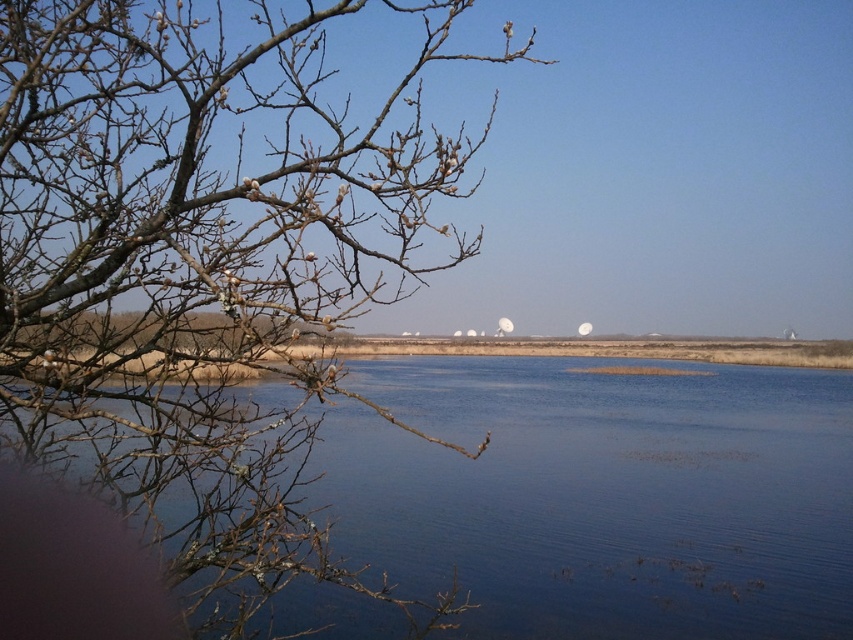
Question: Does bare branches at left have a greater width compared to blue water at center?

Choices:
 (A) yes
 (B) no

Answer: (B)

Question: Is bare branches at left thinner than blue water at center?

Choices:
 (A) no
 (B) yes

Answer: (B)

Question: Which of the following is the farthest from the observer?

Choices:
 (A) bare branches at left
 (B) blue water at center

Answer: (B)

Question: Which point appears closest to the camera in this image?

Choices:
 (A) (477, 531)
 (B) (277, 241)

Answer: (B)

Question: Does bare branches at left appear over blue water at center?

Choices:
 (A) yes
 (B) no

Answer: (B)